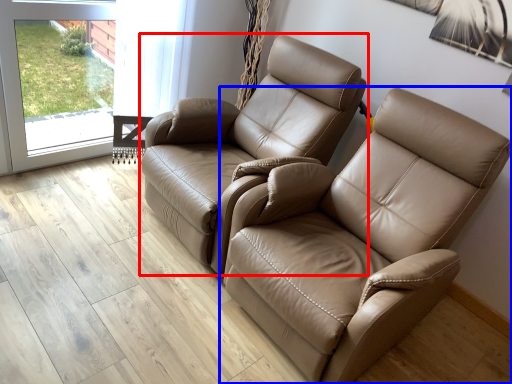
Question: Which object is further to the camera taking this photo, chair (highlighted by a red box) or chair (highlighted by a blue box)?

Choices:
 (A) chair
 (B) chair

Answer: (A)